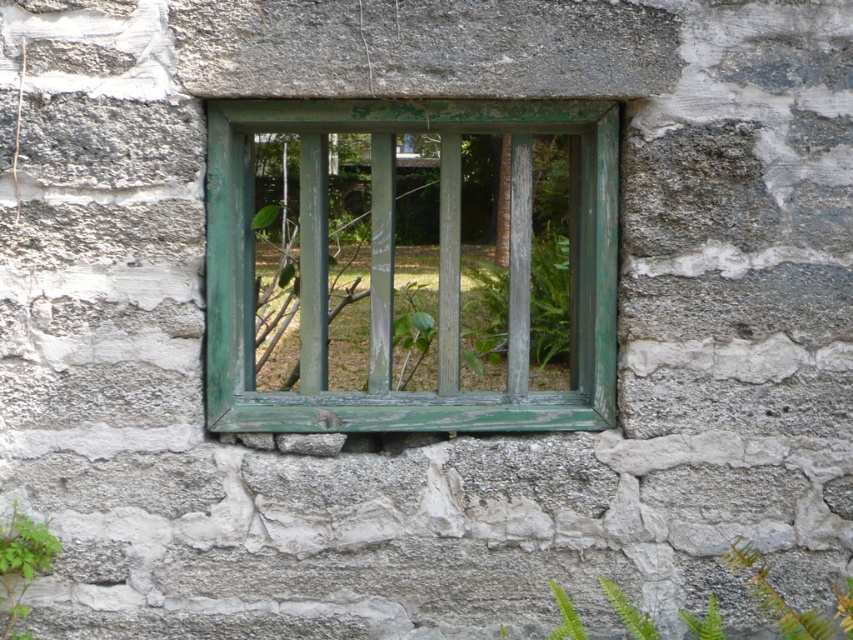
What are the coordinates of the green weathered wood at center?

The coordinates of the green weathered wood at center are at point [392,268].

You are standing in front of the window and want to place a small decorative item on the green weathered wood at center. Can you also place another decorative item on the green leafy plant at lower left without it falling off?

The green weathered wood at center is above the green leafy plant at lower left, so placing an item on the green leafy plant at lower left may cause it to fall off since it is lower and possibly less stable.